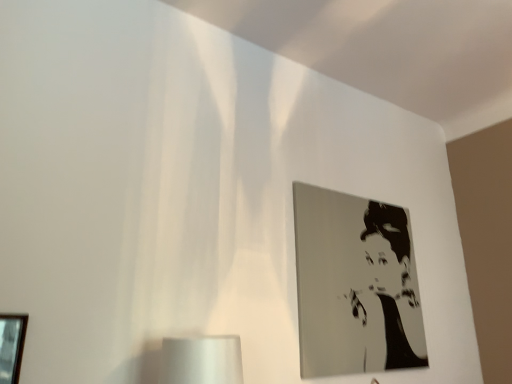
Question: Is metallic silver portrait at upper right, placed as the second picture frame when sorted from front to back, with wooden picture frame at lower left, the 2th picture frame viewed from the right?

Choices:
 (A) no
 (B) yes

Answer: (A)

Question: Does metallic silver portrait at upper right, arranged as the 1th picture frame when viewed from the back, appear on the right side of wooden picture frame at lower left, the first picture frame viewed from the front?

Choices:
 (A) yes
 (B) no

Answer: (A)

Question: From the image's perspective, does metallic silver portrait at upper right, the first picture frame positioned from the right, appear higher than wooden picture frame at lower left, the 2th picture frame viewed from the right?

Choices:
 (A) no
 (B) yes

Answer: (B)

Question: Does metallic silver portrait at upper right, arranged as the 1th picture frame when viewed from the back, have a greater width compared to wooden picture frame at lower left, acting as the second picture frame starting from the back?

Choices:
 (A) no
 (B) yes

Answer: (B)

Question: Is metallic silver portrait at upper right, acting as the 2th picture frame starting from the left, outside of wooden picture frame at lower left, acting as the second picture frame starting from the back?

Choices:
 (A) yes
 (B) no

Answer: (A)

Question: From the image's perspective, is metallic silver portrait at upper right, arranged as the 1th picture frame when viewed from the back, beneath wooden picture frame at lower left, acting as the second picture frame starting from the back?

Choices:
 (A) no
 (B) yes

Answer: (A)

Question: Is wooden picture frame at lower left, the first picture frame viewed from the front, closer to the viewer compared to metallic silver portrait at upper right, acting as the 2th picture frame starting from the left?

Choices:
 (A) yes
 (B) no

Answer: (A)

Question: Is wooden picture frame at lower left, the first picture frame viewed from the front, facing towards metallic silver portrait at upper right, arranged as the 1th picture frame when viewed from the back?

Choices:
 (A) yes
 (B) no

Answer: (B)

Question: From the image's perspective, is wooden picture frame at lower left, marked as the first picture frame in a left-to-right arrangement, above metallic silver portrait at upper right, arranged as the 1th picture frame when viewed from the back?

Choices:
 (A) yes
 (B) no

Answer: (B)

Question: Is metallic silver portrait at upper right, acting as the 2th picture frame starting from the left, at the back of wooden picture frame at lower left, marked as the first picture frame in a left-to-right arrangement?

Choices:
 (A) no
 (B) yes

Answer: (A)

Question: From a real-world perspective, is wooden picture frame at lower left, the 2th picture frame viewed from the right, on metallic silver portrait at upper right, arranged as the 1th picture frame when viewed from the back?

Choices:
 (A) no
 (B) yes

Answer: (A)

Question: Can you confirm if wooden picture frame at lower left, acting as the second picture frame starting from the back, is positioned to the right of metallic silver portrait at upper right, placed as the second picture frame when sorted from front to back?

Choices:
 (A) no
 (B) yes

Answer: (A)

Question: From a real-world perspective, relative to metallic silver portrait at upper right, acting as the 2th picture frame starting from the left, is wooden picture frame at lower left, the first picture frame viewed from the front, vertically above or below?

Choices:
 (A) above
 (B) below

Answer: (B)